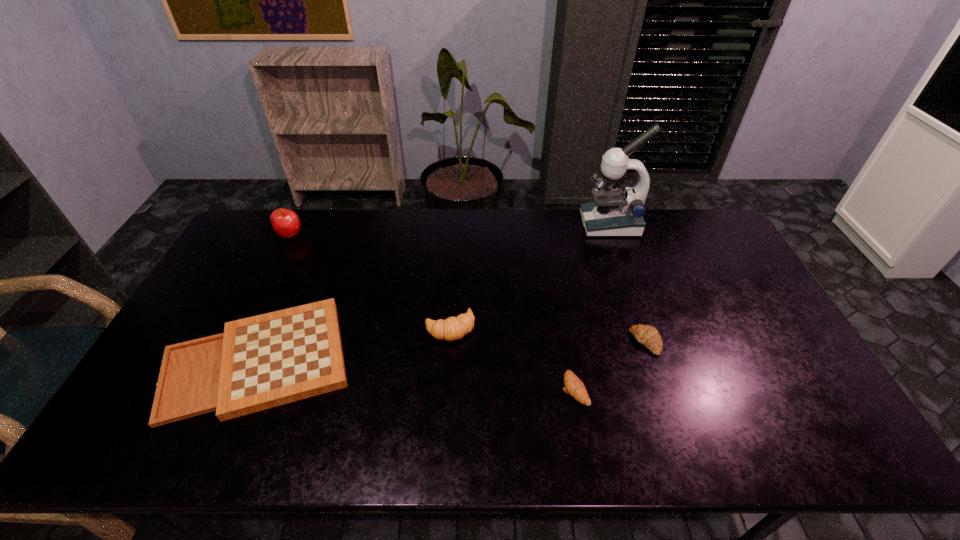
This screenshot has height=540, width=960. In order to click on apple that is at the left edge in this screenshot , I will do `click(286, 223)`.

Identify the location of gameboard that is at the left edge. (260, 362).

The width and height of the screenshot is (960, 540). I want to click on object situated at the far left corner, so click(286, 223).

At what (x,y) coordinates should I click in order to perform the action: click on object that is at the near left corner. Please return your answer as a coordinate pair (x, y). The height and width of the screenshot is (540, 960). Looking at the image, I should click on (260, 362).

You are a GUI agent. You are given a task and a screenshot of the screen. Output one action in this format:
    pyautogui.click(x=<x>, y=<y>)
    Task: Click on the free space at the far edge of the desktop
    Image resolution: width=960 pixels, height=540 pixels.
    Given the screenshot: What is the action you would take?
    click(x=537, y=242)

At what (x,y) coordinates should I click in order to perform the action: click on free point at the near edge. Please return your answer as a coordinate pair (x, y). This screenshot has height=540, width=960. Looking at the image, I should click on (415, 436).

Where is `vacant space at the left edge of the desktop`? vacant space at the left edge of the desktop is located at coordinates (239, 308).

The image size is (960, 540). I want to click on free space at the right edge of the desktop, so click(781, 413).

Image resolution: width=960 pixels, height=540 pixels. In the image, there is a desktop. In order to click on vacant space at the far left corner in this screenshot , I will do `click(262, 227)`.

At what (x,y) coordinates should I click in order to perform the action: click on vacant position at the near left corner of the desktop. Please return your answer as a coordinate pair (x, y). The width and height of the screenshot is (960, 540). Looking at the image, I should click on [117, 446].